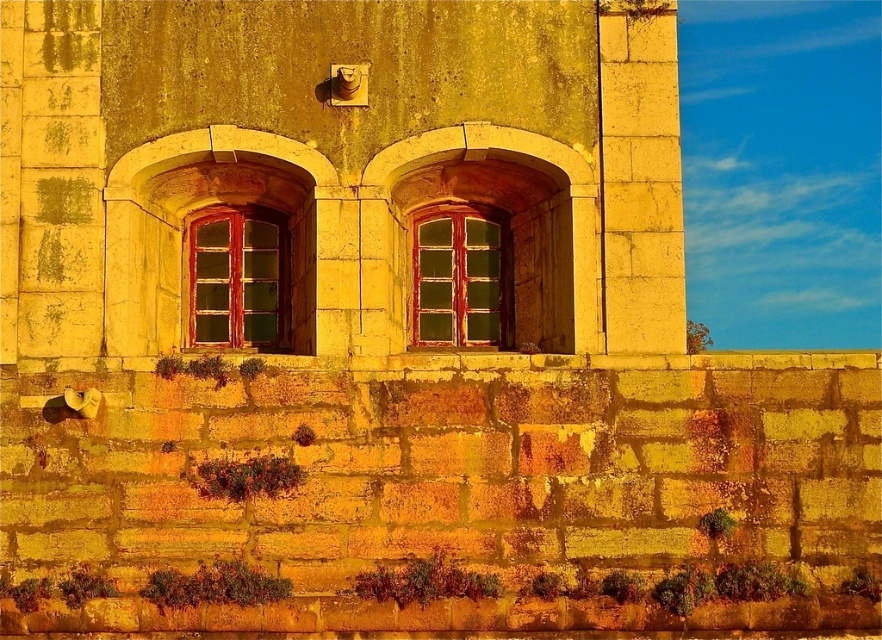
Which is more to the left, matte red wooden window at center or green glass window at center?

Positioned to the left is matte red wooden window at center.

From the picture: Does matte red wooden window at center have a lesser width compared to green glass window at center?

No, matte red wooden window at center is not thinner than green glass window at center.

You are a GUI agent. You are given a task and a screenshot of the screen. Output one action in this format:
    pyautogui.click(x=<x>, y=<y>)
    Task: Click on the matte red wooden window at center
    
    Given the screenshot: What is the action you would take?
    pyautogui.click(x=238, y=278)

Locate an element on the screen. This screenshot has height=640, width=882. matte red wooden window at center is located at coordinates (238, 278).